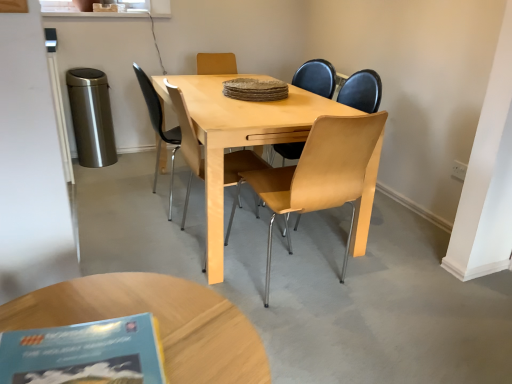
Question: Does blue paper book at lower left come in front of light brown wooden coffee table at lower center?

Choices:
 (A) yes
 (B) no

Answer: (A)

Question: Can you confirm if blue paper book at lower left is bigger than light brown wooden coffee table at lower center?

Choices:
 (A) no
 (B) yes

Answer: (A)

Question: Can you confirm if blue paper book at lower left is taller than light brown wooden coffee table at lower center?

Choices:
 (A) no
 (B) yes

Answer: (A)

Question: Does blue paper book at lower left touch light brown wooden coffee table at lower center?

Choices:
 (A) yes
 (B) no

Answer: (B)

Question: From the image's perspective, is blue paper book at lower left located above light brown wooden coffee table at lower center?

Choices:
 (A) no
 (B) yes

Answer: (B)

Question: In terms of width, does blue paper book at lower left look wider or thinner when compared to light brown wooden coffee table at lower center?

Choices:
 (A) thin
 (B) wide

Answer: (A)

Question: From a real-world perspective, is blue paper book at lower left positioned above or below light brown wooden coffee table at lower center?

Choices:
 (A) above
 (B) below

Answer: (A)

Question: Visually, is blue paper book at lower left positioned to the left or to the right of light brown wooden coffee table at lower center?

Choices:
 (A) left
 (B) right

Answer: (B)

Question: Is blue paper book at lower left inside the boundaries of light brown wooden coffee table at lower center, or outside?

Choices:
 (A) inside
 (B) outside

Answer: (B)

Question: In terms of size, does light brown wooden coffee table at lower center appear bigger or smaller than light brown wood chair at center, positioned as the 1th chair in left-to-right order?

Choices:
 (A) small
 (B) big

Answer: (A)

Question: Considering the positions of light brown wooden coffee table at lower center and light brown wood chair at center, positioned as the 1th chair in left-to-right order, in the image, is light brown wooden coffee table at lower center wider or thinner than light brown wood chair at center, positioned as the 1th chair in left-to-right order,?

Choices:
 (A) thin
 (B) wide

Answer: (A)

Question: From the image's perspective, is light brown wooden coffee table at lower center located above or below light brown wood chair at center, positioned as the 1th chair in left-to-right order?

Choices:
 (A) below
 (B) above

Answer: (A)

Question: Is light brown wooden coffee table at lower center inside the boundaries of light brown wood chair at center, which is counted as the 2th chair, starting from the right, or outside?

Choices:
 (A) outside
 (B) inside

Answer: (A)

Question: Considering the positions of light brown wooden coffee table at lower center and blue paper book at lower left in the image, is light brown wooden coffee table at lower center bigger or smaller than blue paper book at lower left?

Choices:
 (A) big
 (B) small

Answer: (A)

Question: Is light brown wooden coffee table at lower center inside or outside of blue paper book at lower left?

Choices:
 (A) inside
 (B) outside

Answer: (B)